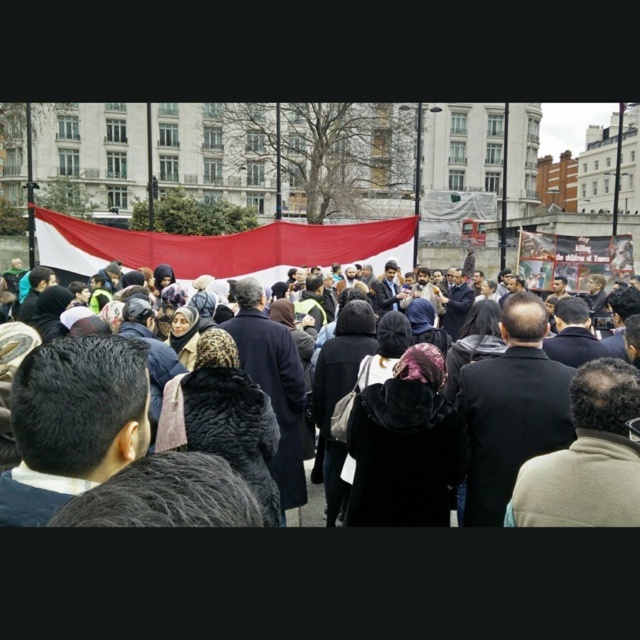
Question: Which point is closer to the camera taking this photo?

Choices:
 (A) (61, 269)
 (B) (266, 292)

Answer: (A)

Question: Where is red fabric banner at center located in relation to dark gray coat at center in the image?

Choices:
 (A) below
 (B) above

Answer: (B)

Question: Among these objects, which one is nearest to the camera?

Choices:
 (A) dark gray coat at center
 (B) red fabric banner at center

Answer: (A)

Question: Which of the following is the closest to the observer?

Choices:
 (A) red fabric banner at center
 (B) dark gray coat at center

Answer: (B)

Question: Is red fabric banner at center behind dark gray coat at center?

Choices:
 (A) yes
 (B) no

Answer: (A)

Question: Does red fabric banner at center come in front of dark gray coat at center?

Choices:
 (A) no
 (B) yes

Answer: (A)